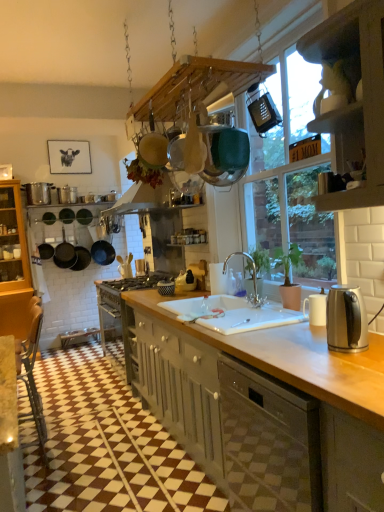
Locate an element on the screen. This screenshot has width=384, height=512. white textured window at upper center is located at coordinates (284, 162).

Image resolution: width=384 pixels, height=512 pixels. Describe the element at coordinates (316, 308) in the screenshot. I see `white ceramic mug at right, which is the first appliance from right to left` at that location.

What do you see at coordinates (199, 273) in the screenshot?
I see `matte silver toaster at center, which is the 2th appliance from front to back` at bounding box center [199, 273].

In order to face white ceramic sink at center, should I rotate leftwards or rightwards?

You should look right and rotate roughly 4.365 degrees.

Measure the distance between point [178,309] and camera.

Point [178,309] is 2.49 meters from camera.

I want to click on white textured window at upper center, so click(x=284, y=162).

From the picture: Is clear glass faucet at center surrounded by brushed metal pots at left, the first appliance when ordered from top to bottom?

No, brushed metal pots at left, the first appliance when ordered from top to bottom, does not contain clear glass faucet at center.

Is brushed metal pots at left, the fourth appliance in the front-to-back sequence, turned away from clear glass faucet at center?

No.

From a real-world perspective, who is located lower, brushed metal pots at left, the fourth appliance in the front-to-back sequence, or clear glass faucet at center?

clear glass faucet at center, from a real-world perspective.

Would you consider brushed metal pots at left, the fourth appliance in the front-to-back sequence, to be distant from clear glass faucet at center?

Yes, brushed metal pots at left, the fourth appliance in the front-to-back sequence, is far from clear glass faucet at center.

From a real-world perspective, is white wood cabinet at upper right, which is the second cabinetry from back to front, positioned above or below matte gray cabinetry at center, the second cabinetry from the front?

Clearly, from a real-world perspective, white wood cabinet at upper right, which is the second cabinetry from back to front, is above matte gray cabinetry at center, the second cabinetry from the front.

Who is shorter, white wood cabinet at upper right, which appears as the 2th cabinetry when ordered from the bottom, or matte gray cabinetry at center, arranged as the first cabinetry when ordered from the bottom?

white wood cabinet at upper right, which appears as the 2th cabinetry when ordered from the bottom, is shorter.

Looking at the image, does white wood cabinet at upper right, placed as the 1th cabinetry when sorted from top to bottom, seem bigger or smaller compared to matte gray cabinetry at center, which is the 1th cabinetry from back to front?

white wood cabinet at upper right, placed as the 1th cabinetry when sorted from top to bottom, is smaller than matte gray cabinetry at center, which is the 1th cabinetry from back to front.

Considering the points (338, 118) and (138, 330), which point is behind, point (338, 118) or point (138, 330)?

The point (138, 330) is more distant.

Which is farther from the camera, [198,289] or [68,164]?

The point [68,164] is behind.

From the image's perspective, which is below, matte silver toaster at center, placed as the second appliance when sorted from top to bottom, or black paper picture frame at upper left?

matte silver toaster at center, placed as the second appliance when sorted from top to bottom, is shown below in the image.

Who is shorter, matte silver toaster at center, which is the 2th appliance from front to back, or black paper picture frame at upper left?

matte silver toaster at center, which is the 2th appliance from front to back.

Between matte silver toaster at center, the 3th appliance ordered from the bottom, and black paper picture frame at upper left, which one has larger size?

black paper picture frame at upper left.

Based on the photo, from a real-world perspective, who is located lower, black paper picture frame at upper left or matte gray cabinetry at center, which is the 1th cabinetry from back to front?

From a 3D spatial view, matte gray cabinetry at center, which is the 1th cabinetry from back to front, is below.

Does black paper picture frame at upper left have a lesser height compared to matte gray cabinetry at center, which appears as the second cabinetry when viewed from the top?

Correct, black paper picture frame at upper left is not as tall as matte gray cabinetry at center, which appears as the second cabinetry when viewed from the top.

Is black paper picture frame at upper left bigger than matte gray cabinetry at center, arranged as the first cabinetry when ordered from the bottom?

No.

Does black paper picture frame at upper left lie behind matte gray cabinetry at center, arranged as the first cabinetry when ordered from the bottom?

That is True.

In the scene shown: Does matte silver toaster at center, the 3th appliance ordered from the bottom, have a larger size compared to white textured window at upper center?

Actually, matte silver toaster at center, the 3th appliance ordered from the bottom, might be smaller than white textured window at upper center.

Would you say matte silver toaster at center, which ranks as the 3th appliance in back-to-front order, contains white textured window at upper center?

No, matte silver toaster at center, which ranks as the 3th appliance in back-to-front order, does not contain white textured window at upper center.

Based on the photo, is matte silver toaster at center, placed as the second appliance when sorted from top to bottom, to the left of white textured window at upper center from the viewer's perspective?

Indeed, matte silver toaster at center, placed as the second appliance when sorted from top to bottom, is positioned on the left side of white textured window at upper center.

Is white ceramic mug at right, marked as the 1th appliance in a bottom-to-top arrangement, oriented towards white wood cabinet at upper right, which is the second cabinetry from back to front?

No, white ceramic mug at right, marked as the 1th appliance in a bottom-to-top arrangement, is not facing towards white wood cabinet at upper right, which is the second cabinetry from back to front.

How far apart are white ceramic mug at right, acting as the 4th appliance starting from the back, and white wood cabinet at upper right, placed as the 1th cabinetry when sorted from top to bottom?

32.69 inches.

From the picture: Is white ceramic mug at right, which appears as the first appliance when viewed from the front, shorter than white wood cabinet at upper right, which appears as the 2th cabinetry when ordered from the bottom?

Yes, white ceramic mug at right, which appears as the first appliance when viewed from the front, is shorter than white wood cabinet at upper right, which appears as the 2th cabinetry when ordered from the bottom.

From a real-world perspective, does white ceramic mug at right, marked as the 1th appliance in a bottom-to-top arrangement, sit lower than white wood cabinet at upper right, placed as the 1th cabinetry when sorted from top to bottom?

Yes.

Who is smaller, matte silver toaster at center, placed as the second appliance when sorted from top to bottom, or brushed metal toaster at center, arranged as the 2th appliance when viewed from the left?

matte silver toaster at center, placed as the second appliance when sorted from top to bottom, is smaller.

Is matte silver toaster at center, which is the 2th appliance from front to back, touching brushed metal toaster at center, which appears as the second appliance when ordered from the bottom?

No, matte silver toaster at center, which is the 2th appliance from front to back, is not in contact with brushed metal toaster at center, which appears as the second appliance when ordered from the bottom.

Considering the sizes of matte silver toaster at center, which appears as the 2th appliance when viewed from the right, and brushed metal toaster at center, which appears as the second appliance when ordered from the bottom, in the image, is matte silver toaster at center, which appears as the 2th appliance when viewed from the right, wider or thinner than brushed metal toaster at center, which appears as the second appliance when ordered from the bottom,?

matte silver toaster at center, which appears as the 2th appliance when viewed from the right, is thinner than brushed metal toaster at center, which appears as the second appliance when ordered from the bottom.

Which is behind, point (195, 265) or point (142, 272)?

The point (142, 272) is more distant.

Where is `the 3rd appliance above the clear glass faucet at center (from the image's perspective)`? This screenshot has height=512, width=384. the 3rd appliance above the clear glass faucet at center (from the image's perspective) is located at coordinates (38, 193).

Where is `cabinetry that appears below the white wood cabinet at upper right, which appears as the 2th cabinetry when ordered from the bottom (from a real-world perspective)`? The width and height of the screenshot is (384, 512). cabinetry that appears below the white wood cabinet at upper right, which appears as the 2th cabinetry when ordered from the bottom (from a real-world perspective) is located at coordinates (264, 406).

Considering their positions, is white ceramic sink at center positioned further to brushed metal pots at left, the first appliance when ordered from top to bottom, than clear glass faucet at center?

white ceramic sink at center.

When comparing their distances from matte silver toaster at center, the 3th appliance ordered from the bottom, does clear glass faucet at center or black paper picture frame at upper left seem further?

black paper picture frame at upper left is positioned further to the anchor matte silver toaster at center, the 3th appliance ordered from the bottom.

When comparing their distances from brushed metal pots at left, the 1th appliance from the left, does stainless steel kettle at right or black paper picture frame at upper left seem closer?

The object closer to brushed metal pots at left, the 1th appliance from the left, is black paper picture frame at upper left.

Estimate the real-world distances between objects in this image. Which object is closer to clear glass faucet at center, stainless steel kettle at right or brushed metal toaster at center, which appears as the second appliance when ordered from the bottom?

stainless steel kettle at right is closer to clear glass faucet at center.

When comparing their distances from matte silver toaster at center, which appears as the 2th appliance when viewed from the right, does clear glass faucet at center or stainless steel kettle at right seem further?

stainless steel kettle at right lies further to matte silver toaster at center, which appears as the 2th appliance when viewed from the right, than the other object.

From the image, which object appears to be farther from brown leather chair at lower left, matte gray cabinetry at center, which appears as the second cabinetry when viewed from the top, or black paper picture frame at upper left?

The object further to brown leather chair at lower left is black paper picture frame at upper left.

Looking at the image, which one is located closer to white ceramic sink at center, stainless steel kettle at right or black paper picture frame at upper left?

stainless steel kettle at right is closer to white ceramic sink at center.

Considering their positions, is white wood cabinet at upper right, which appears as the 2th cabinetry when ordered from the bottom, positioned further to matte gray cabinetry at center, arranged as the first cabinetry when ordered from the bottom, than brushed metal toaster at center, which is counted as the 3th appliance, starting from the front?

Among the two, brushed metal toaster at center, which is counted as the 3th appliance, starting from the front, is located further to matte gray cabinetry at center, arranged as the first cabinetry when ordered from the bottom.

I want to click on tap between white wood cabinet at upper right, arranged as the first cabinetry when viewed from the front, and matte gray cabinetry at center, arranged as the first cabinetry when ordered from the bottom, in the vertical direction, so click(x=252, y=278).

This screenshot has width=384, height=512. I want to click on chair between stainless steel kettle at right and brushed metal pots at left, acting as the first appliance starting from the back, from front to back, so click(x=33, y=379).

Locate an element on the screen. Image resolution: width=384 pixels, height=512 pixels. chair located between white wood cabinet at upper right, which is the second cabinetry from back to front, and matte silver toaster at center, which appears as the 2th appliance when viewed from the right, in the depth direction is located at coordinates (33, 379).

In order to click on tap positioned between matte gray cabinetry at center, the second cabinetry from the front, and brushed metal toaster at center, which is counted as the third appliance, starting from the right, from near to far in this screenshot , I will do `click(252, 278)`.